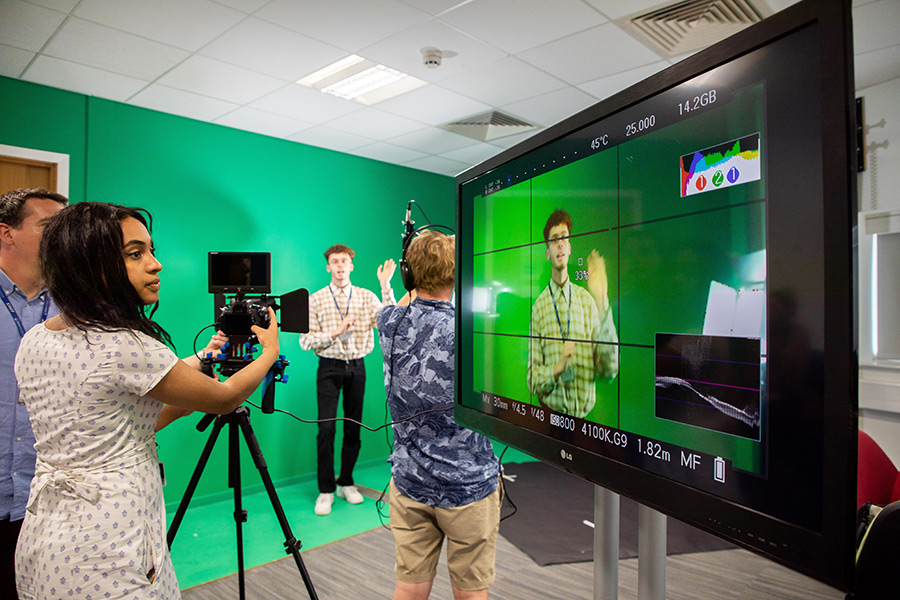
The image size is (900, 600). I want to click on ceiling panels, so click(382, 118).